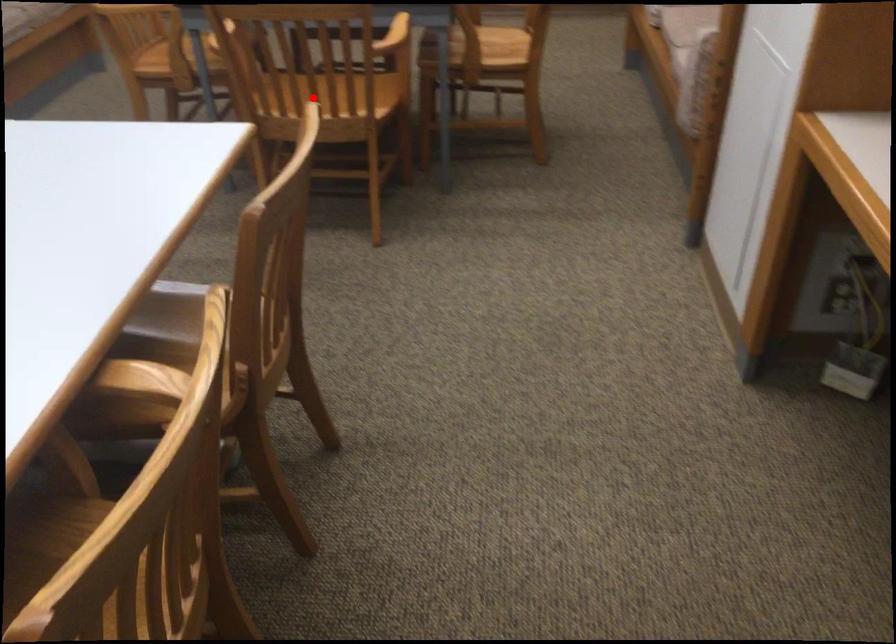
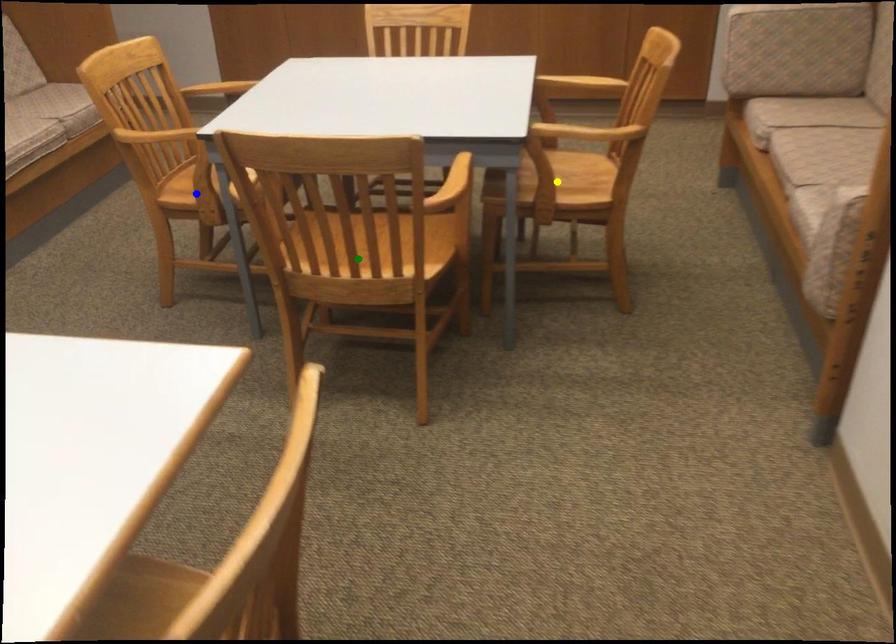
Question: I am providing you with two images of the same scene from different viewpoints. A red point is marked on the first image. You are given multiple points on the second image. Which point in image 2 represents the same 3d spot as the red point in image 1?

Choices:
 (A) yellow point
 (B) green point
 (C) blue point

Answer: (B)